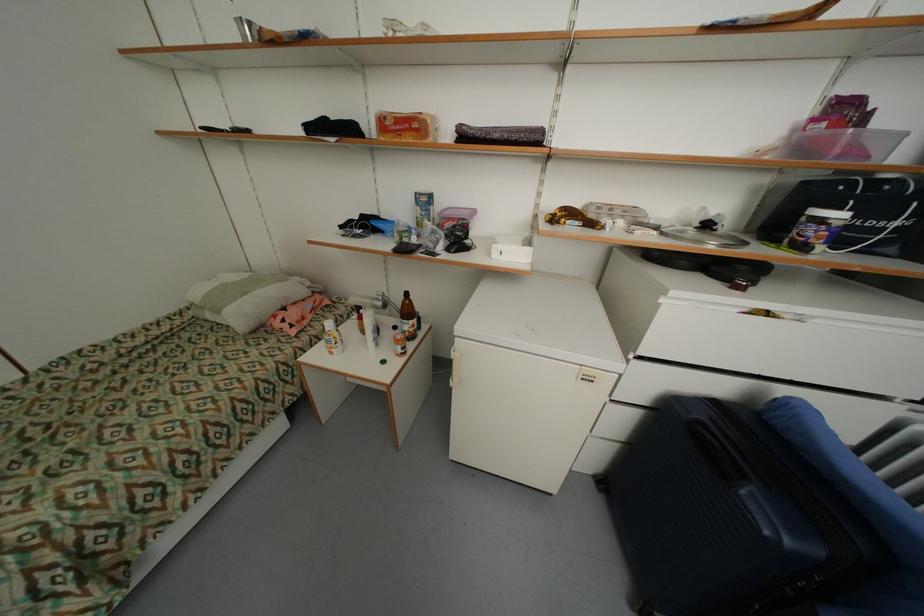
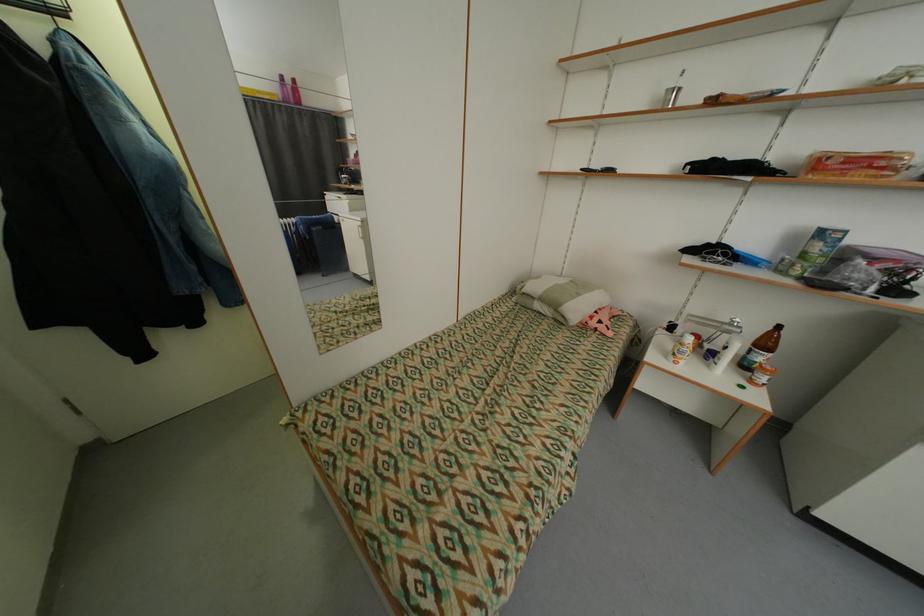
The images are taken continuously from a first-person perspective. In which direction are you moving?

The cameraman walked toward left, backward.